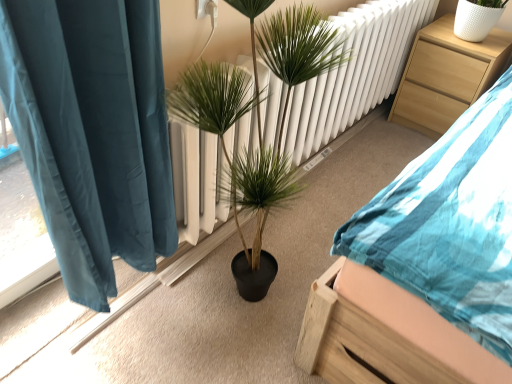
The width and height of the screenshot is (512, 384). I want to click on wooden bed at center, so click(425, 267).

Where is `green leafy plant at center`? This screenshot has width=512, height=384. green leafy plant at center is located at coordinates (259, 124).

Image resolution: width=512 pixels, height=384 pixels. What do you see at coordinates (446, 76) in the screenshot?
I see `light wood nightstand at upper right` at bounding box center [446, 76].

This screenshot has height=384, width=512. I want to click on wooden bed at center, so click(425, 267).

Is green leafy plant at center facing away from light wood nightstand at upper right?

green leafy plant at center does not have its back to light wood nightstand at upper right.

In terms of height, does green leafy plant at center look taller or shorter compared to light wood nightstand at upper right?

Considering their sizes, green leafy plant at center has more height than light wood nightstand at upper right.

Do you think green leafy plant at center is within light wood nightstand at upper right, or outside of it?

green leafy plant at center is not enclosed by light wood nightstand at upper right.

From the image's perspective, is green leafy plant at center over light wood nightstand at upper right?

No, from the image's perspective, green leafy plant at center is not over light wood nightstand at upper right.

How different are the orientations of light wood nightstand at upper right and wooden bed at center in degrees?

The facing directions of light wood nightstand at upper right and wooden bed at center are 0.554 degrees apart.

Between light wood nightstand at upper right and wooden bed at center, which one is positioned in front?

wooden bed at center is more forward.

Considering the sizes of light wood nightstand at upper right and wooden bed at center in the image, is light wood nightstand at upper right taller or shorter than wooden bed at center?

light wood nightstand at upper right is shorter than wooden bed at center.

Consider the image. Considering the relative positions of light wood nightstand at upper right and wooden bed at center in the image provided, is light wood nightstand at upper right to the right of wooden bed at center from the viewer's perspective?

Yes, light wood nightstand at upper right is to the right of wooden bed at center.

From a real-world perspective, is wooden bed at center positioned over green leafy plant at center based on gravity?

No, from a real-world perspective, wooden bed at center is not over green leafy plant at center

Is wooden bed at center oriented towards green leafy plant at center?

No, wooden bed at center is not oriented towards green leafy plant at center.

From the image's perspective, between wooden bed at center and green leafy plant at center, which one is located above?

wooden bed at center appears higher in the image.

This screenshot has height=384, width=512. In order to click on houseplant to the left of wooden bed at center in this screenshot , I will do `click(259, 124)`.

From a real-world perspective, which is physically above, light wood nightstand at upper right or green leafy plant at center?

In real-world perspective, green leafy plant at center is above.

Is light wood nightstand at upper right to the left of green leafy plant at center from the viewer's perspective?

Incorrect, light wood nightstand at upper right is not on the left side of green leafy plant at center.

Does point (466, 100) appear closer or farther from the camera than point (255, 66)?

Point (466, 100) is positioned farther from the camera compared to point (255, 66).

From the image's perspective, who appears lower, wooden bed at center or light wood nightstand at upper right?

wooden bed at center.

Which of these two, wooden bed at center or light wood nightstand at upper right, is bigger?

wooden bed at center is bigger.

From a real-world perspective, which object rests below the other?

light wood nightstand at upper right, from a real-world perspective.

Is wooden bed at center facing towards light wood nightstand at upper right?

No, wooden bed at center is not facing towards light wood nightstand at upper right.

Is the position of green leafy plant at center less distant than that of wooden bed at center?

No.

Is green leafy plant at center completely or partially outside of wooden bed at center?

Absolutely, green leafy plant at center is external to wooden bed at center.

From the image's perspective, is green leafy plant at center above or below wooden bed at center?

From the image's perspective, green leafy plant at center appears below wooden bed at center.

Is green leafy plant at center facing towards wooden bed at center?

Yes, green leafy plant at center is facing wooden bed at center.

Find the location of `nightstand below the green leafy plant at center (from a real-world perspective)`. nightstand below the green leafy plant at center (from a real-world perspective) is located at coordinates (446, 76).

What are the coordinates of `bed in front of the light wood nightstand at upper right` in the screenshot? It's located at (425, 267).

Which object lies nearer to the anchor point wooden bed at center, green leafy plant at center or light wood nightstand at upper right?

green leafy plant at center is positioned closer to the anchor wooden bed at center.

Looking at the image, which one is located closer to light wood nightstand at upper right, wooden bed at center or green leafy plant at center?

wooden bed at center is positioned closer to the anchor light wood nightstand at upper right.

Consider the image. When comparing their distances from green leafy plant at center, does light wood nightstand at upper right or wooden bed at center seem further?

Among the two, light wood nightstand at upper right is located further to green leafy plant at center.

Based on their spatial positions, is green leafy plant at center or wooden bed at center further from light wood nightstand at upper right?

Among the two, green leafy plant at center is located further to light wood nightstand at upper right.

From the image, which object appears to be farther from wooden bed at center, light wood nightstand at upper right or green leafy plant at center?

light wood nightstand at upper right is positioned further to the anchor wooden bed at center.

From the image, which object appears to be nearer to green leafy plant at center, wooden bed at center or light wood nightstand at upper right?

Among the two, wooden bed at center is located nearer to green leafy plant at center.

Locate an element on the screen. The image size is (512, 384). houseplant between wooden bed at center and light wood nightstand at upper right in the front-back direction is located at coordinates (259, 124).